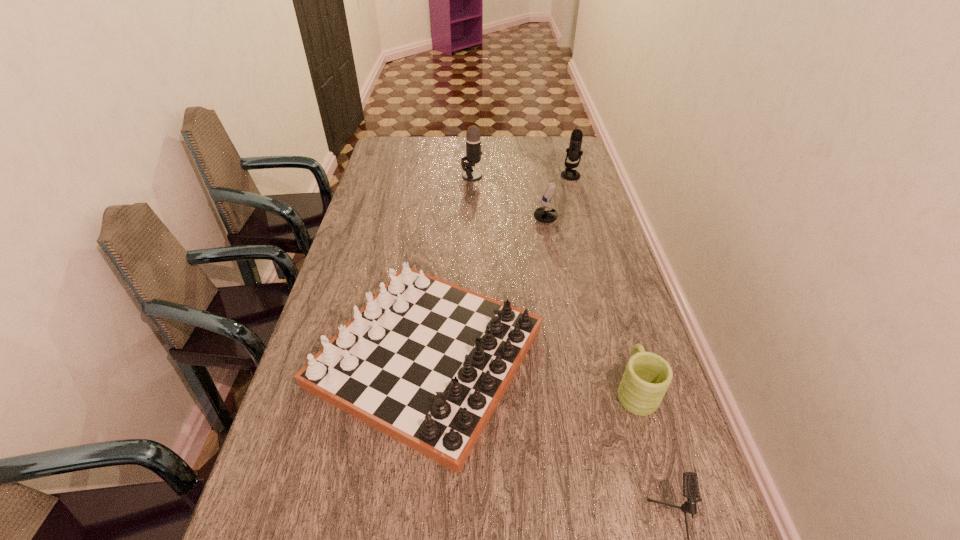
Find the location of a particular element. This screenshot has width=960, height=540. the leftmost microphone is located at coordinates (473, 136).

This screenshot has width=960, height=540. In order to click on the third tallest microphone in this screenshot , I will do `click(545, 214)`.

This screenshot has height=540, width=960. I want to click on the second nearest microphone, so click(x=545, y=214).

Find the location of a particular element. This screenshot has width=960, height=540. gameboard is located at coordinates (426, 362).

Identify the location of mug. (647, 376).

Identify the location of free region located 0.120m on the front of the leftmost microphone. This screenshot has height=540, width=960. (471, 198).

Where is `vacant position located on the front of the second shortest microphone`? Image resolution: width=960 pixels, height=540 pixels. vacant position located on the front of the second shortest microphone is located at coordinates (571, 260).

This screenshot has height=540, width=960. Find the location of `free space located 0.170m on the back of the gameboard`. free space located 0.170m on the back of the gameboard is located at coordinates (440, 242).

At what (x,y) coordinates should I click in order to perform the action: click on vacant space located 0.080m on the side of the mug with the handle. Please return your answer as a coordinate pair (x, y). The image size is (960, 540). Looking at the image, I should click on (621, 341).

This screenshot has height=540, width=960. I want to click on free space located on the side of the mug with the handle, so click(602, 276).